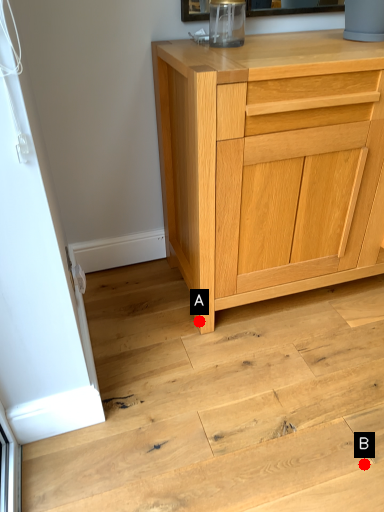
Question: Two points are circled on the image, labeled by A and B beside each circle. Among these points, which one is farthest from the camera?

Choices:
 (A) A is further
 (B) B is further

Answer: (A)